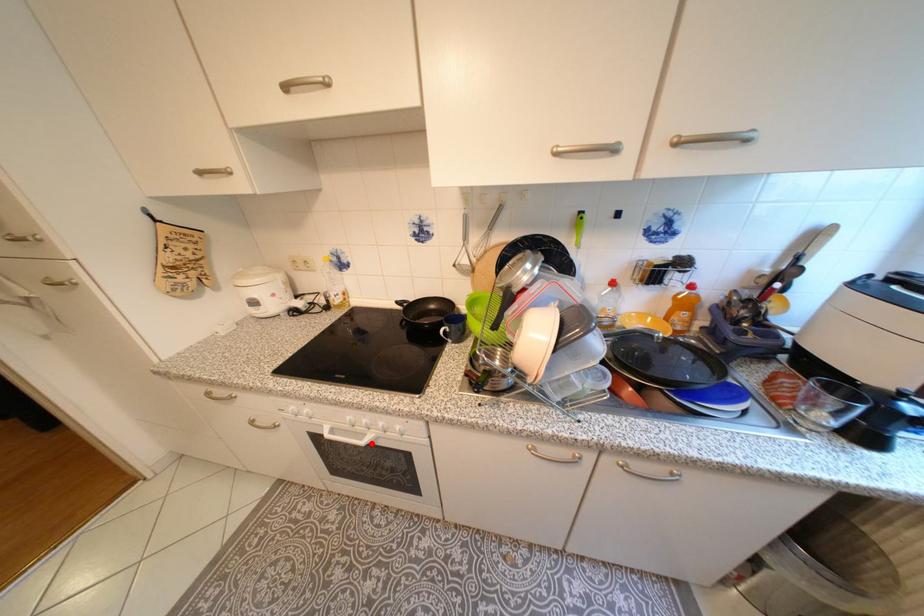
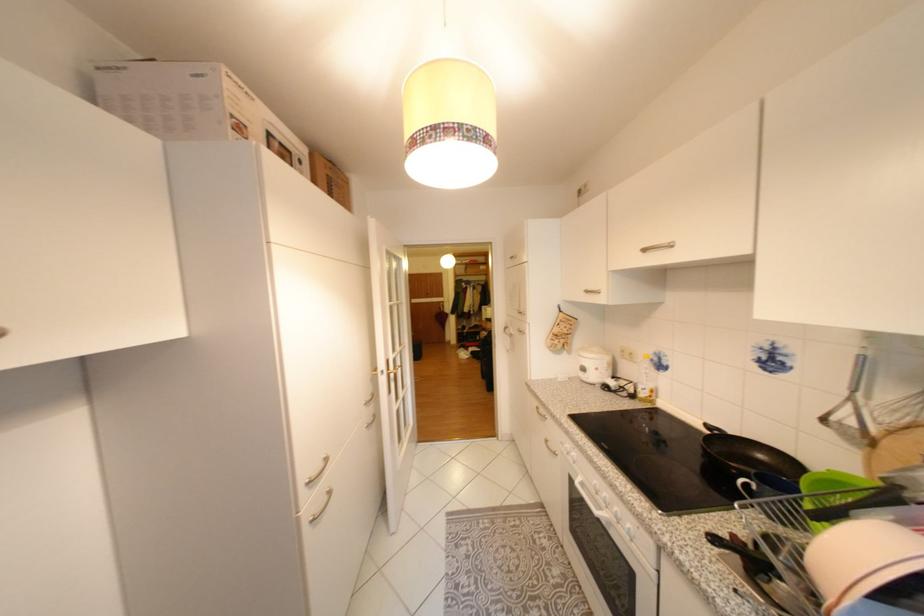
Find the pixel in the second image that matches the highlighted location in the first image.

(605, 513)